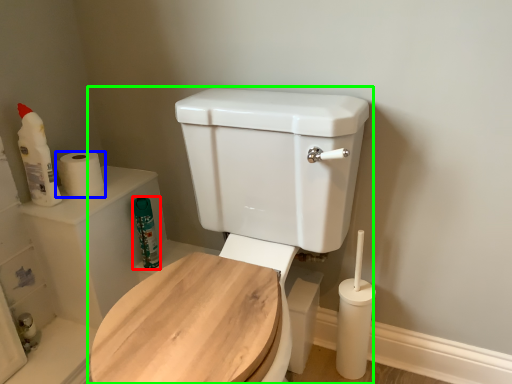
Question: Which is nearer to the cleaning product (highlighted by a red box)? toilet paper (highlighted by a blue box) or toilet (highlighted by a green box).

Choices:
 (A) toilet paper
 (B) toilet

Answer: (A)